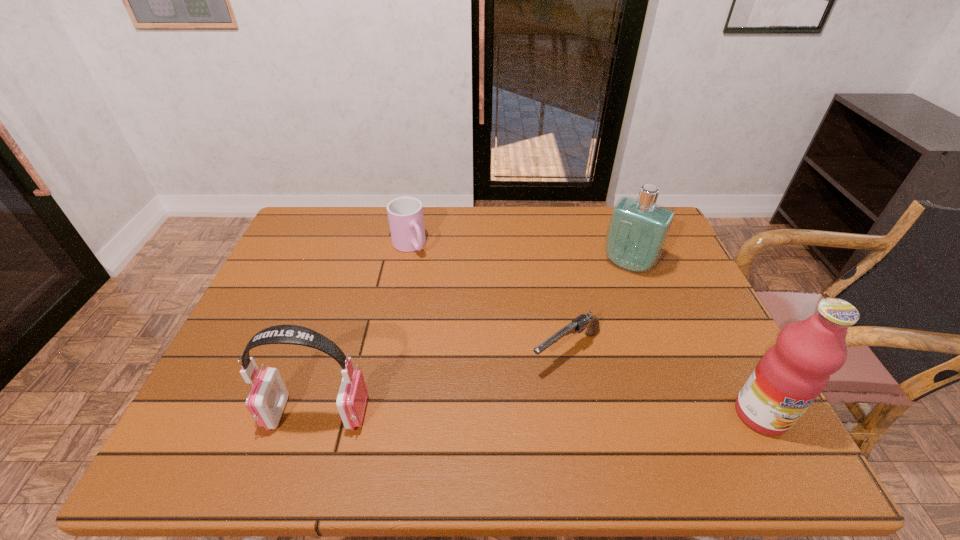
Locate an element on the screen. free point located 0.350m with the handle on the side of the cup is located at coordinates (473, 333).

At what (x,y) coordinates should I click in order to perform the action: click on vacant space positioned 0.210m with the handle on the side of the cup. Please return your answer as a coordinate pair (x, y). This screenshot has width=960, height=540. Looking at the image, I should click on (448, 300).

Locate an element on the screen. free space located with the handle on the side of the cup is located at coordinates (478, 338).

This screenshot has width=960, height=540. Identify the location of free space located 0.160m on the front label of the perfume. (598, 312).

You are a GUI agent. You are given a task and a screenshot of the screen. Output one action in this format:
    pyautogui.click(x=<x>, y=<y>)
    Task: Click on the free region located 0.120m on the front label of the perfume
    
    Given the screenshot: What is the action you would take?
    pyautogui.click(x=603, y=303)

Where is `blank space located 0.350m on the front label of the perfume`? The width and height of the screenshot is (960, 540). blank space located 0.350m on the front label of the perfume is located at coordinates (568, 360).

Locate an element on the screen. Image resolution: width=960 pixels, height=540 pixels. vacant space situated 0.150m aiming along the barrel of the third object from right to left is located at coordinates tap(492, 403).

The image size is (960, 540). Find the location of `free space located aiming along the barrel of the third object from right to left`. free space located aiming along the barrel of the third object from right to left is located at coordinates (517, 384).

The width and height of the screenshot is (960, 540). Find the location of `vacant space situated aiming along the barrel of the third object from right to left`. vacant space situated aiming along the barrel of the third object from right to left is located at coordinates (494, 401).

You are a GUI agent. You are given a task and a screenshot of the screen. Output one action in this format:
    pyautogui.click(x=<x>, y=<y>)
    Task: Click on the cup that is at the far edge
    The height and width of the screenshot is (540, 960).
    Given the screenshot: What is the action you would take?
    pyautogui.click(x=405, y=214)